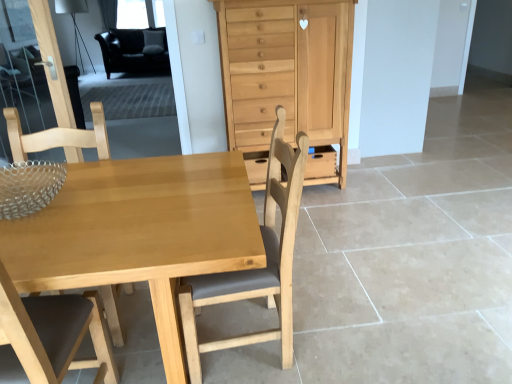
Question: From the image's perspective, is light brown wood chair at center, which ranks as the first chair in right-to-left order, above light wood table at center?

Choices:
 (A) yes
 (B) no

Answer: (A)

Question: Is light brown wood chair at center, the 2th chair from the left, thinner than light wood table at center?

Choices:
 (A) yes
 (B) no

Answer: (A)

Question: Is the surface of light brown wood chair at center, which ranks as the first chair in right-to-left order, in direct contact with light wood table at center?

Choices:
 (A) yes
 (B) no

Answer: (B)

Question: Can you confirm if light brown wood chair at center, which ranks as the first chair in right-to-left order, is taller than light wood table at center?

Choices:
 (A) no
 (B) yes

Answer: (B)

Question: Is light brown wood chair at center, the 2th chair from the left, at the left side of light wood table at center?

Choices:
 (A) no
 (B) yes

Answer: (A)

Question: Choose the correct answer: Is black leather armchair at upper left inside transparent glass door at upper left or outside it?

Choices:
 (A) inside
 (B) outside

Answer: (B)

Question: In the image, is black leather armchair at upper left positioned in front of or behind transparent glass door at upper left?

Choices:
 (A) behind
 (B) front

Answer: (A)

Question: In terms of width, does black leather armchair at upper left look wider or thinner when compared to transparent glass door at upper left?

Choices:
 (A) wide
 (B) thin

Answer: (A)

Question: Based on their positions, is black leather armchair at upper left located to the left or right of transparent glass door at upper left?

Choices:
 (A) left
 (B) right

Answer: (A)

Question: Is natural wood chest of drawers at center wider or thinner than light brown wood chair at left, the first chair from the left?

Choices:
 (A) wide
 (B) thin

Answer: (A)

Question: From a real-world perspective, is natural wood chest of drawers at center above or below light brown wood chair at left, the 2th chair when ordered from right to left?

Choices:
 (A) above
 (B) below

Answer: (A)

Question: Considering the positions of natural wood chest of drawers at center and light brown wood chair at left, the first chair from the left, in the image, is natural wood chest of drawers at center taller or shorter than light brown wood chair at left, the first chair from the left,?

Choices:
 (A) tall
 (B) short

Answer: (A)

Question: Which is correct: natural wood chest of drawers at center is inside light brown wood chair at left, the 2th chair when ordered from right to left, or outside of it?

Choices:
 (A) inside
 (B) outside

Answer: (B)

Question: From a real-world perspective, is natural wood chest of drawers at center above or below light wood table at center?

Choices:
 (A) below
 (B) above

Answer: (B)

Question: Is natural wood chest of drawers at center taller or shorter than light wood table at center?

Choices:
 (A) short
 (B) tall

Answer: (B)